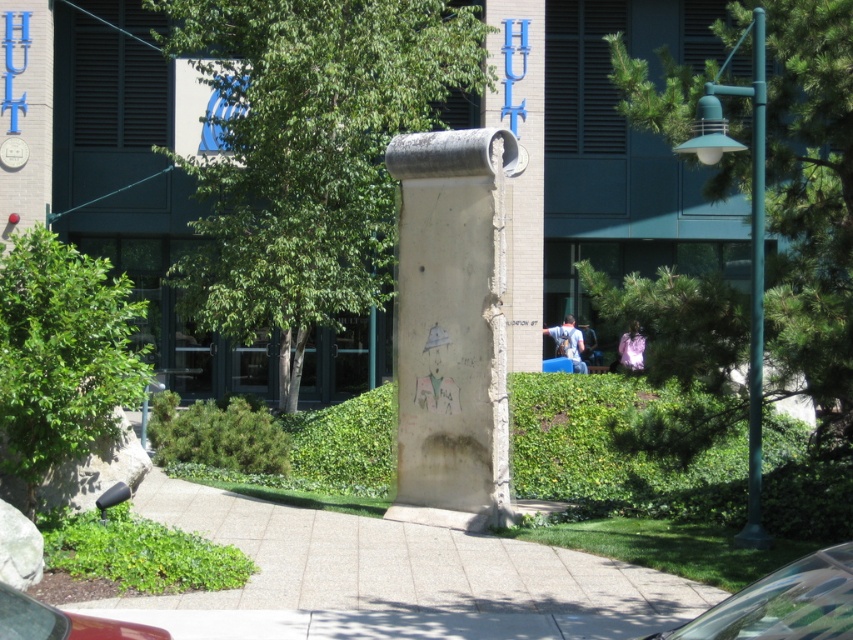
You are an architect analyzing the Berlin Wall section in the image. You notice the concrete at center and the white concrete pillar at center. Which of these two objects takes up more area in the scene?

The white concrete pillar at center occupies more space than the concrete at center, so it takes up more area in the scene.

You are a landscape architect planning to add a new tree to the area. The existing green leafy tree at center and the concrete at center are already present. Which object should you consider for space availability when deciding where to plant the new tree?

The green leafy tree at center is smaller than the concrete at center, so you should consider the space around the concrete at center as it occupies more area and may require more clearance for the new tree.